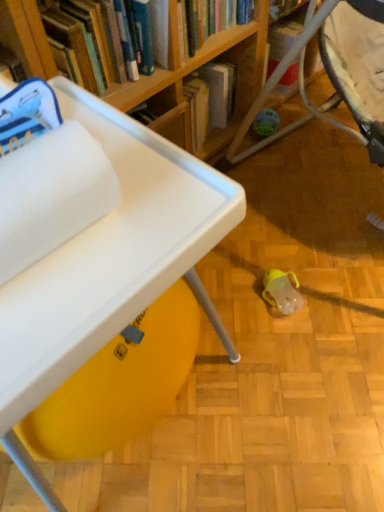
You are a GUI agent. You are given a task and a screenshot of the screen. Output one action in this format:
    pyautogui.click(x=<x>, y=<y>)
    Task: Click on the vacant space to the right of white plastic table at lower left
    
    Given the screenshot: What is the action you would take?
    pyautogui.click(x=287, y=391)